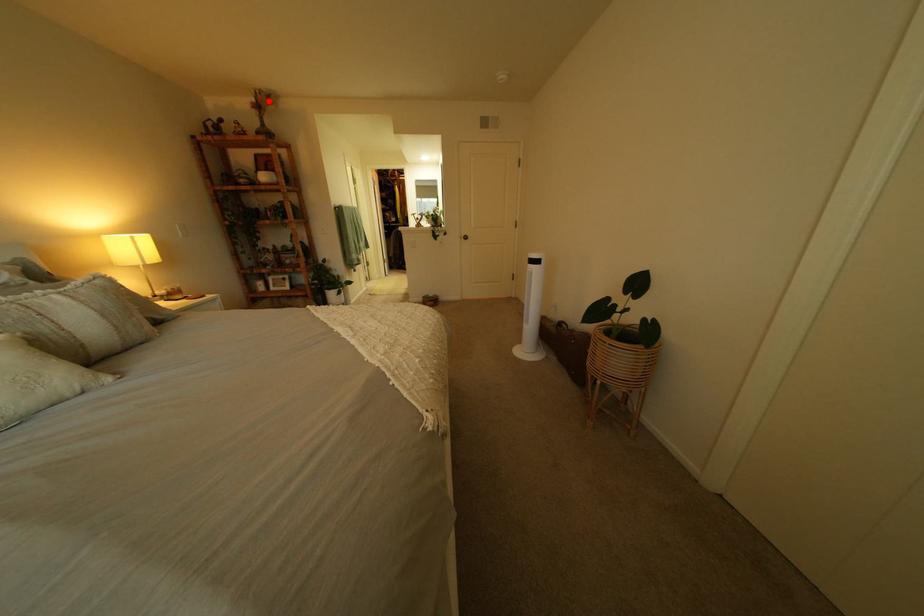
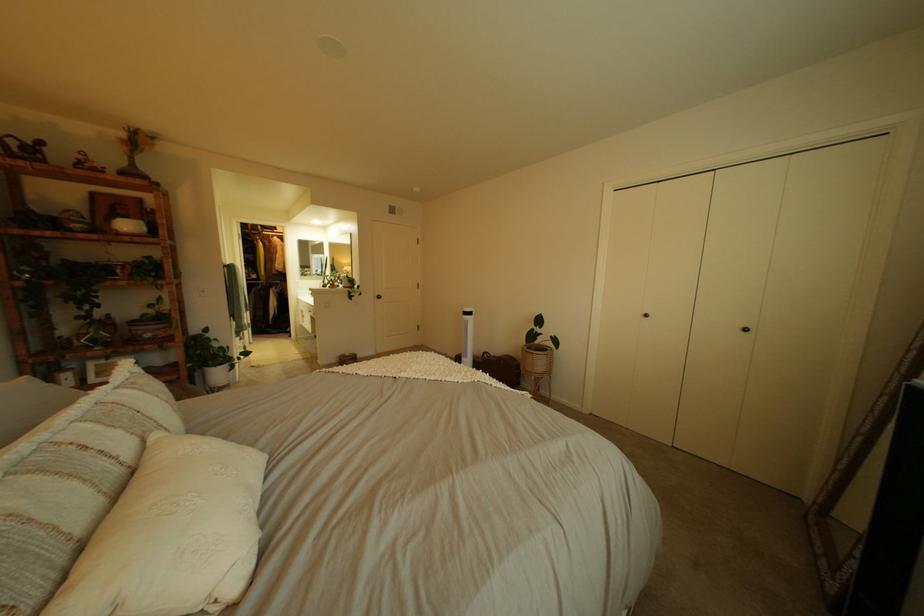
The point at the highlighted location is marked in the first image. Where is the corresponding point in the second image?

(139, 137)